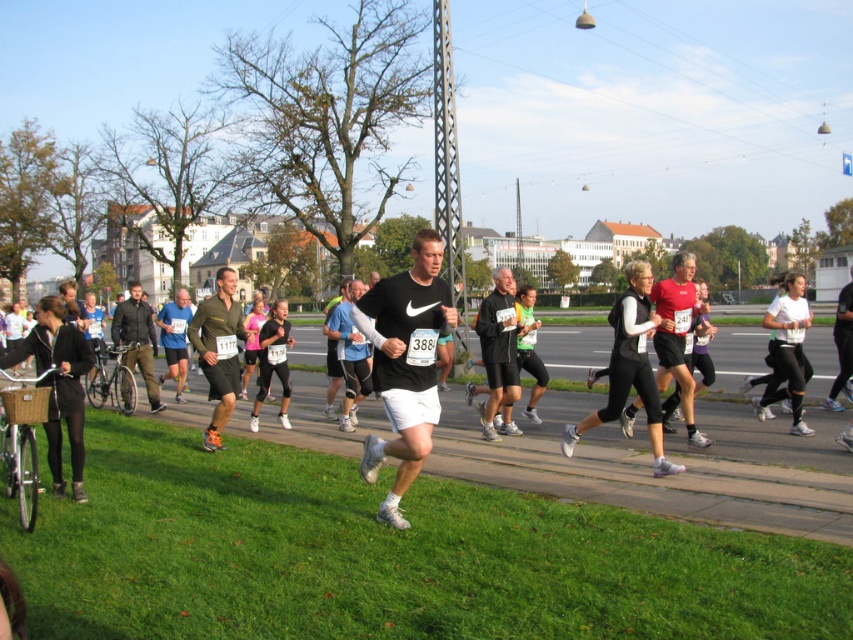
You are a photographer at the marathon and want to capture a closeup of the black matte running shoe at center and the matte green shorts at center. Which object should you zoom in on more to ensure both fit in the frame?

The black matte running shoe at center is narrower than the matte green shorts at center, so you should zoom in more on the black matte running shoe at center to ensure both fit in the frame.

You are a photographer standing at the starting line of the marathon. You want to take a closeup shot of the black matte shorts at center. Given that your camera has a minimum focusing distance of 5 meters, will you be able to take the photo without moving closer?

The black matte shorts at center are 9.43 meters away from the camera. Since the minimum focusing distance is 5 meters, the camera can focus on the subject as the distance is sufficient. Therefore, you can take the closeup shot without moving closer.

You are a photographer at the marathon event. You want to take a photo that includes both the black matte running shoe at center and the matte blue shirt at center. Which object should you focus on first if you want to ensure both are in sharp focus?

The black matte running shoe at center has a lesser height compared to matte blue shirt at center. Therefore, you should focus on the matte blue shirt at center first since it is taller and likely closer to the background, ensuring depth of field captures both.